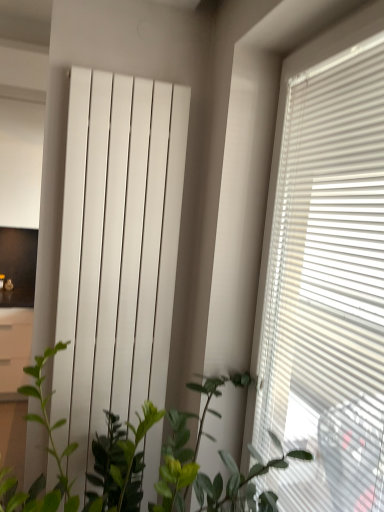
Question: Based on their sizes in the image, would you say white glossy radiator at center is bigger or smaller than white matte window blind at right?

Choices:
 (A) small
 (B) big

Answer: (A)

Question: Is white glossy radiator at center in front of or behind white matte window blind at right in the image?

Choices:
 (A) behind
 (B) front

Answer: (A)

Question: Estimate the real-world distances between objects in this image. Which object is farther from the white matte window blind at right?

Choices:
 (A) green leafy plant at center
 (B) white glossy file cabinet at left
 (C) white glossy radiator at center

Answer: (B)

Question: Estimate the real-world distances between objects in this image. Which object is closer to the white glossy radiator at center?

Choices:
 (A) white matte window blind at right
 (B) white glossy file cabinet at left
 (C) green leafy plant at center

Answer: (C)